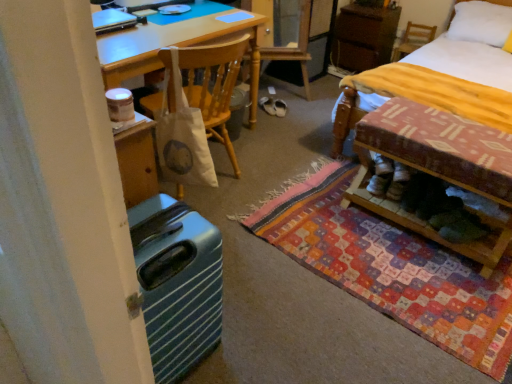
Locate an element on the screen. free spot below multicolored woven mat at lower right (from a real-world perspective) is located at coordinates (399, 259).